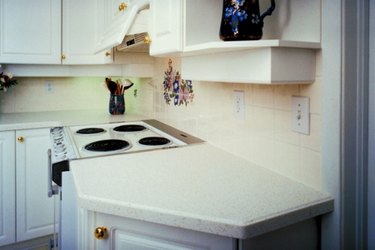
This screenshot has width=375, height=250. Find the location of `top right burner`. top right burner is located at coordinates (159, 141).